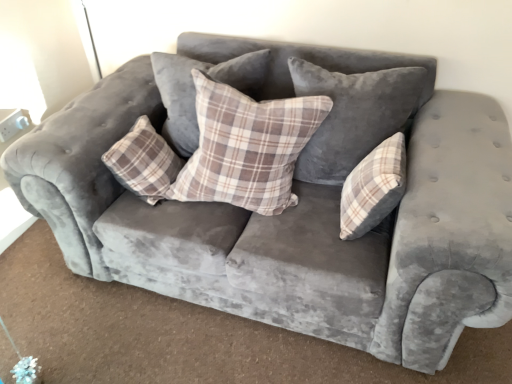
Question: Considering the relative sizes of plaid fabric pillow at center, which is the fourth pillow in right-to-left order, and plaid fabric pillow at center, which is the fourth pillow in left-to-right order, in the image provided, is plaid fabric pillow at center, which is the fourth pillow in right-to-left order, shorter than plaid fabric pillow at center, which is the fourth pillow in left-to-right order,?

Choices:
 (A) yes
 (B) no

Answer: (B)

Question: Is plaid fabric pillow at center, arranged as the first pillow when viewed from the left, touching plaid fabric pillow at center, which is the fourth pillow in left-to-right order?

Choices:
 (A) yes
 (B) no

Answer: (B)

Question: Is plaid fabric pillow at center, which is the fourth pillow in right-to-left order, not inside plaid fabric pillow at center, which is the fourth pillow in left-to-right order?

Choices:
 (A) no
 (B) yes

Answer: (B)

Question: Is plaid fabric pillow at center, arranged as the first pillow when viewed from the left, facing away from plaid fabric pillow at center, placed as the first pillow when sorted from right to left?

Choices:
 (A) no
 (B) yes

Answer: (A)

Question: Is plaid fabric pillow at center, arranged as the first pillow when viewed from the left, to the right of plaid fabric pillow at center, which is the fourth pillow in left-to-right order, from the viewer's perspective?

Choices:
 (A) no
 (B) yes

Answer: (A)

Question: Is plaid fabric pillow at center, arranged as the first pillow when viewed from the left, spatially inside plaid fabric pillow at center, which is counted as the 2th pillow, starting from the left, or outside of it?

Choices:
 (A) outside
 (B) inside

Answer: (A)

Question: Considering the positions of plaid fabric pillow at center, which is the fourth pillow in right-to-left order, and plaid fabric pillow at center, which is the 3th pillow from right to left, in the image, is plaid fabric pillow at center, which is the fourth pillow in right-to-left order, taller or shorter than plaid fabric pillow at center, which is the 3th pillow from right to left,?

Choices:
 (A) short
 (B) tall

Answer: (A)

Question: Based on their sizes in the image, would you say plaid fabric pillow at center, which is the fourth pillow in right-to-left order, is bigger or smaller than plaid fabric pillow at center, which is the 3th pillow from right to left?

Choices:
 (A) small
 (B) big

Answer: (A)

Question: Is plaid fabric pillow at center, which is the fourth pillow in right-to-left order, in front of or behind plaid fabric pillow at center, which is the 3th pillow from right to left, in the image?

Choices:
 (A) front
 (B) behind

Answer: (B)

Question: From a real-world perspective, relative to plaid fabric pillow at center, which is the fourth pillow in right-to-left order, is plaid fabric pillow at center, placed as the first pillow when sorted from right to left, vertically above or below?

Choices:
 (A) above
 (B) below

Answer: (B)

Question: From the image's perspective, relative to plaid fabric pillow at center, which is the fourth pillow in right-to-left order, is plaid fabric pillow at center, which is the fourth pillow in left-to-right order, above or below?

Choices:
 (A) above
 (B) below

Answer: (B)

Question: Looking at their shapes, would you say plaid fabric pillow at center, placed as the first pillow when sorted from right to left, is wider or thinner than plaid fabric pillow at center, arranged as the first pillow when viewed from the left?

Choices:
 (A) thin
 (B) wide

Answer: (A)

Question: Is plaid fabric pillow at center, which is the fourth pillow in left-to-right order, inside or outside of plaid fabric pillow at center, which is the fourth pillow in right-to-left order?

Choices:
 (A) outside
 (B) inside

Answer: (A)

Question: Is velvet plaid pillow at center, the third pillow when ordered from left to right, situated inside plaid fabric pillow at center, arranged as the first pillow when viewed from the left, or outside?

Choices:
 (A) inside
 (B) outside

Answer: (B)

Question: Based on their sizes in the image, would you say velvet plaid pillow at center, which ranks as the second pillow in right-to-left order, is bigger or smaller than plaid fabric pillow at center, which is the fourth pillow in right-to-left order?

Choices:
 (A) big
 (B) small

Answer: (A)